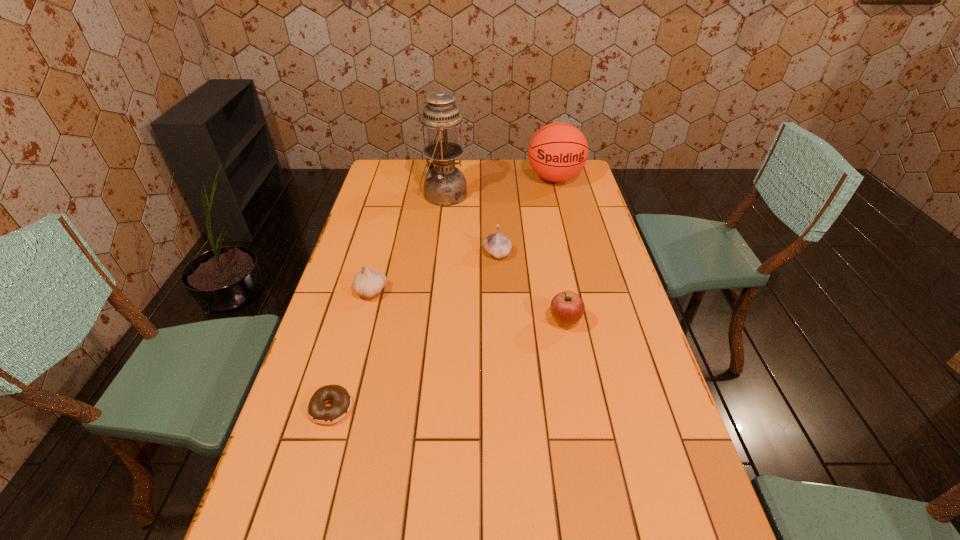
Image resolution: width=960 pixels, height=540 pixels. Find the location of `the fourth object from right to left`. the fourth object from right to left is located at coordinates (445, 185).

The width and height of the screenshot is (960, 540). I want to click on the tallest object, so click(x=445, y=185).

Find the location of a particular element. The image size is (960, 540). the fifth shortest object is located at coordinates tap(558, 151).

Image resolution: width=960 pixels, height=540 pixels. In order to click on the taller garlic in this screenshot , I will do 496,244.

The image size is (960, 540). I want to click on the right garlic, so click(496, 244).

Find the location of `the fifth farthest object`. the fifth farthest object is located at coordinates (567, 308).

Where is `the second shortest object`? the second shortest object is located at coordinates (368, 283).

The image size is (960, 540). Identify the location of the left garlic. (368, 283).

This screenshot has height=540, width=960. Identify the location of the nearest object. (341, 399).

Locate an element on the screen. This screenshot has width=960, height=540. doughnut is located at coordinates (341, 399).